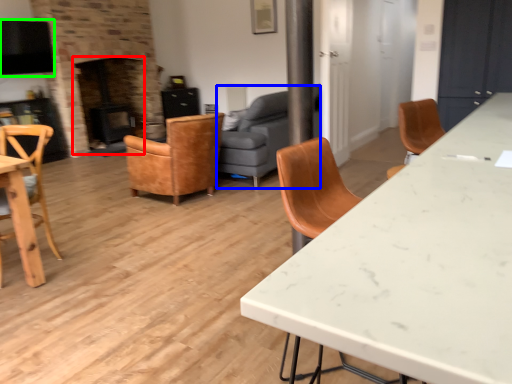
Question: Based on their relative distances, which object is nearer to fireplace (highlighted by a red box)? Choose from studio couch (highlighted by a blue box) and exhaust hood (highlighted by a green box).

Choices:
 (A) studio couch
 (B) exhaust hood

Answer: (B)